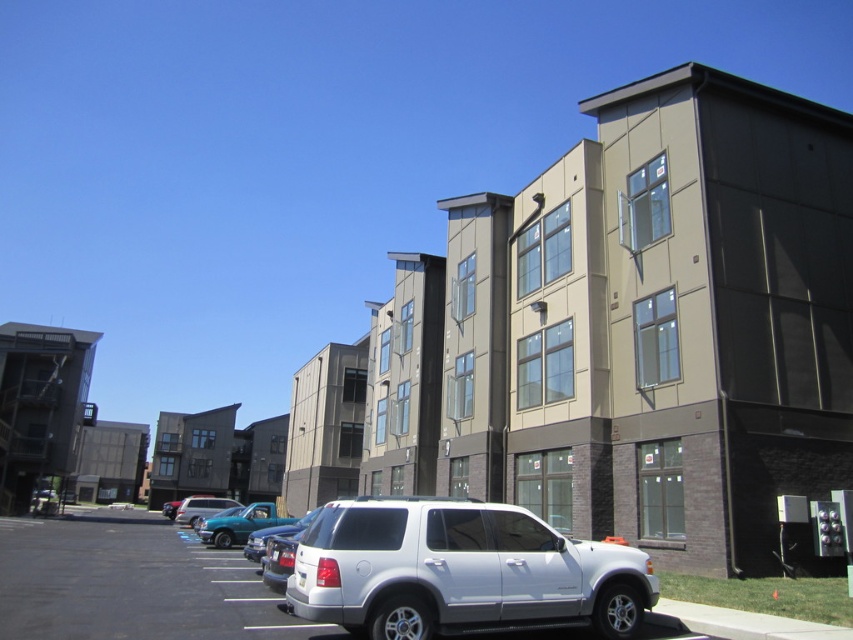
You are a delivery driver who needs to park a new vehicle in the parking lot. The new vehicle is the same size as the teal glossy truck at lower left. Can the white matte suv at center be moved to make space for the new vehicle without overlapping?

The white matte suv at center occupies less space than teal glossy truck at lower left, so moving the white matte suv at center would free up enough space for the teal glossy truck at lower left sized vehicle.

You are a delivery driver who needs to park your van in the parking lot near the white matte suv at center and the matte silver suv at center. The parking spot between them is 10 feet wide. Can your van, which is 8.5 feet wide, fit into that space?

The parking spot between the white matte suv at center and the matte silver suv at center is 10 feet wide. Since your van is 8.5 feet wide, it can fit into the space as it is narrower than the available width.